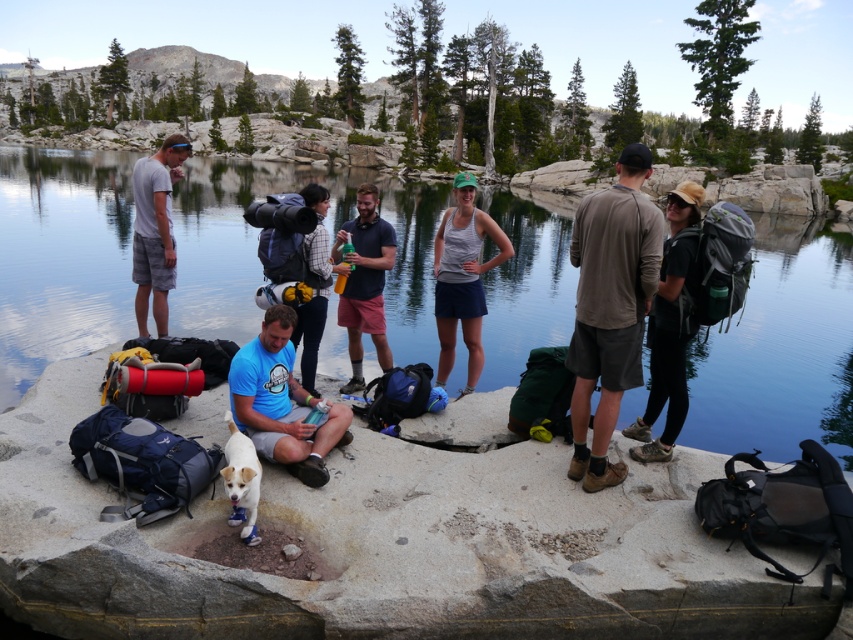
Is dark blue t-shirt at center in front of matte gray t-shirt at left?

Yes, dark blue t-shirt at center is closer to the viewer.

Can you confirm if dark blue t-shirt at center is thinner than matte gray t-shirt at left?

Yes, dark blue t-shirt at center is thinner than matte gray t-shirt at left.

At what (x,y) coordinates should I click in order to perform the action: click on dark blue t-shirt at center. Please return your answer as a coordinate pair (x, y). The width and height of the screenshot is (853, 640). Looking at the image, I should click on (364, 282).

You are a GUI agent. You are given a task and a screenshot of the screen. Output one action in this format:
    pyautogui.click(x=<x>, y=<y>)
    Task: Click on the dark blue t-shirt at center
    
    Given the screenshot: What is the action you would take?
    pyautogui.click(x=364, y=282)

Does blue fabric shirt at center have a greater width compared to dark blue t-shirt at center?

Indeed, blue fabric shirt at center has a greater width compared to dark blue t-shirt at center.

In the scene shown: Between blue fabric shirt at center and dark blue t-shirt at center, which one appears on the right side from the viewer's perspective?

dark blue t-shirt at center is more to the right.

Is point (309, 480) in front of point (351, 307)?

Yes.

Locate an element on the screen. Image resolution: width=853 pixels, height=640 pixels. blue fabric shirt at center is located at coordinates (282, 403).

Between point (592, 486) and point (373, 230), which one is positioned in front?

Point (592, 486) is in front.

Which is above, brown cotton shirt at right or dark blue t-shirt at center?

Positioned higher is dark blue t-shirt at center.

Is point (618, 305) behind point (380, 241)?

No, it is in front of (380, 241).

The image size is (853, 640). In order to click on brown cotton shirt at right in this screenshot , I will do `click(610, 307)`.